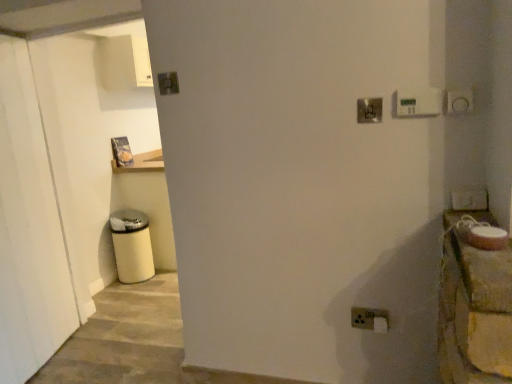
What is the approximate width of rustic wood countertop at right?

It is 4.46 inches.

Identify the location of white plastic light switch at upper right, which appears as the 1th light switch when viewed from the right. The image size is (512, 384). (469, 199).

What do you see at coordinates (370, 319) in the screenshot?
I see `white plastic electric outlet at lower right` at bounding box center [370, 319].

I want to click on white plastic thermostat at upper right, which is the first light switch from front to back, so click(418, 102).

The image size is (512, 384). I want to click on rustic wood countertop at right, so click(474, 307).

Is metallic square at upper center, the 1th light switch when ordered from left to right, situated inside rustic wood countertop at right or outside?

metallic square at upper center, the 1th light switch when ordered from left to right, exists outside the volume of rustic wood countertop at right.

Does point (167, 84) come behind point (464, 278)?

Yes.

Which of these two, metallic square at upper center, the 1th light switch when ordered from left to right, or rustic wood countertop at right, is thinner?

With smaller width is metallic square at upper center, the 1th light switch when ordered from left to right.

Would you consider rustic wood countertop at right to be distant from white plastic thermostat at upper right, the 4th light switch in the back-to-front sequence?

They are positioned close to each other.

Considering the relative sizes of rustic wood countertop at right and white plastic thermostat at upper right, the 4th light switch in the back-to-front sequence, in the image provided, is rustic wood countertop at right wider than white plastic thermostat at upper right, the 4th light switch in the back-to-front sequence,?

Indeed, rustic wood countertop at right has a greater width compared to white plastic thermostat at upper right, the 4th light switch in the back-to-front sequence.

Is rustic wood countertop at right shorter than white plastic thermostat at upper right, which is the third light switch in bottom-to-top order?

In fact, rustic wood countertop at right may be taller than white plastic thermostat at upper right, which is the third light switch in bottom-to-top order.

From a real-world perspective, which object stands above the other?

white plastic thermostat at upper right, the 4th light switch in the back-to-front sequence, from a real-world perspective.

Which is nearer, [432,114] or [464,364]?

Clearly, point [432,114] is more distant from the camera than point [464,364].

From the image's perspective, between white plastic thermostat at upper right, which is the first light switch from front to back, and rustic wood countertop at right, who is located below?

rustic wood countertop at right is shown below in the image.

From the picture: Which is more to the right, white plastic thermostat at upper right, the 4th light switch in the back-to-front sequence, or rustic wood countertop at right?

rustic wood countertop at right is more to the right.

Is point (481, 303) positioned in front of point (365, 328)?

That is True.

Which is correct: rustic wood countertop at right is inside white plastic electric outlet at lower right, or outside of it?

rustic wood countertop at right is spatially situated outside white plastic electric outlet at lower right.

From the picture: Considering the positions of objects rustic wood countertop at right and white plastic electric outlet at lower right in the image provided, who is more to the right, rustic wood countertop at right or white plastic electric outlet at lower right?

From the viewer's perspective, rustic wood countertop at right appears more on the right side.

Is metallic silver switch at upper right, arranged as the third light switch when viewed from the front, spatially inside white plastic light switch at upper right, the 4th light switch viewed from the top, or outside of it?

metallic silver switch at upper right, arranged as the third light switch when viewed from the front, is located beyond the bounds of white plastic light switch at upper right, the 4th light switch viewed from the top.

What's the angular difference between metallic silver switch at upper right, placed as the third light switch when sorted from right to left, and white plastic light switch at upper right, positioned as the 2th light switch in front-to-back order,'s facing directions?

0.475 degrees separate the facing orientations of metallic silver switch at upper right, placed as the third light switch when sorted from right to left, and white plastic light switch at upper right, positioned as the 2th light switch in front-to-back order.

Could you tell me if metallic silver switch at upper right, which ranks as the 3th light switch in top-to-bottom order, is turned towards white plastic light switch at upper right, which appears as the 1th light switch when viewed from the right?

No, metallic silver switch at upper right, which ranks as the 3th light switch in top-to-bottom order, does not turn towards white plastic light switch at upper right, which appears as the 1th light switch when viewed from the right.

Is metallic silver switch at upper right, which ranks as the 2th light switch in back-to-front order, wider or thinner than white plastic thermostat at upper right, marked as the 2th light switch in a right-to-left arrangement?

Clearly, metallic silver switch at upper right, which ranks as the 2th light switch in back-to-front order, has less width compared to white plastic thermostat at upper right, marked as the 2th light switch in a right-to-left arrangement.

Which is in front, point (369, 100) or point (424, 110)?

The point (424, 110) is more forward.

Considering the relative positions of metallic silver switch at upper right, marked as the second light switch in a bottom-to-top arrangement, and white plastic thermostat at upper right, which is the first light switch from front to back, in the image provided, is metallic silver switch at upper right, marked as the second light switch in a bottom-to-top arrangement, to the right of white plastic thermostat at upper right, which is the first light switch from front to back, from the viewer's perspective?

No, metallic silver switch at upper right, marked as the second light switch in a bottom-to-top arrangement, is not to the right of white plastic thermostat at upper right, which is the first light switch from front to back.

Are white plastic thermostat at upper right, which is counted as the 3th light switch, starting from the left, and metallic square at upper center, the fourth light switch in the front-to-back sequence, located far from each other?

No, white plastic thermostat at upper right, which is counted as the 3th light switch, starting from the left, is not far from metallic square at upper center, the fourth light switch in the front-to-back sequence.

Considering the relative sizes of white plastic thermostat at upper right, the 4th light switch in the back-to-front sequence, and metallic square at upper center, the 1th light switch when ordered from left to right, in the image provided, is white plastic thermostat at upper right, the 4th light switch in the back-to-front sequence, shorter than metallic square at upper center, the 1th light switch when ordered from left to right,?

Incorrect, the height of white plastic thermostat at upper right, the 4th light switch in the back-to-front sequence, does not fall short of that of metallic square at upper center, the 1th light switch when ordered from left to right.

Identify the location of light switch that appears above the white plastic thermostat at upper right, which is counted as the 3th light switch, starting from the left (from a real-world perspective). This screenshot has width=512, height=384. (168, 83).

This screenshot has height=384, width=512. In order to click on counter top in front of the metallic square at upper center, the fourth light switch in the front-to-back sequence in this screenshot , I will do `click(474, 307)`.

The height and width of the screenshot is (384, 512). Find the location of `the 1st light switch behind the rustic wood countertop at right, starting your count from the anchor`. the 1st light switch behind the rustic wood countertop at right, starting your count from the anchor is located at coordinates click(x=418, y=102).

Based on their spatial positions, is white plastic light switch at upper right, marked as the third light switch in a back-to-front arrangement, or white plastic electric outlet at lower right closer to metallic silver switch at upper right, which ranks as the 2th light switch in back-to-front order?

white plastic light switch at upper right, marked as the third light switch in a back-to-front arrangement, is positioned closer to the anchor metallic silver switch at upper right, which ranks as the 2th light switch in back-to-front order.

Considering their positions, is metallic silver switch at upper right, which ranks as the 3th light switch in top-to-bottom order, positioned further to white plastic thermostat at upper right, marked as the 2th light switch in a right-to-left arrangement, than rustic wood countertop at right?

rustic wood countertop at right.

Considering their positions, is white plastic thermostat at upper right, which is counted as the 3th light switch, starting from the left, positioned further to rustic wood countertop at right than metallic square at upper center, the fourth light switch in the front-to-back sequence?

metallic square at upper center, the fourth light switch in the front-to-back sequence, lies further to rustic wood countertop at right than the other object.

Considering their positions, is metallic silver switch at upper right, arranged as the third light switch when viewed from the front, positioned further to white plastic electric outlet at lower right than white plastic thermostat at upper right, marked as the 2th light switch in a right-to-left arrangement?

white plastic thermostat at upper right, marked as the 2th light switch in a right-to-left arrangement, is positioned further to the anchor white plastic electric outlet at lower right.

Estimate the real-world distances between objects in this image. Which object is closer to white plastic thermostat at upper right, the 4th light switch in the back-to-front sequence, metallic square at upper center, which ranks as the fourth light switch in bottom-to-top order, or metallic silver switch at upper right, marked as the second light switch in a bottom-to-top arrangement?

The object closer to white plastic thermostat at upper right, the 4th light switch in the back-to-front sequence, is metallic silver switch at upper right, marked as the second light switch in a bottom-to-top arrangement.

Looking at the image, which one is located further to white plastic light switch at upper right, which appears as the 1th light switch when viewed from the right, metallic silver switch at upper right, which ranks as the 3th light switch in top-to-bottom order, or rustic wood countertop at right?

The object further to white plastic light switch at upper right, which appears as the 1th light switch when viewed from the right, is metallic silver switch at upper right, which ranks as the 3th light switch in top-to-bottom order.

From the image, which object appears to be nearer to white plastic light switch at upper right, positioned as the 2th light switch in front-to-back order, white plastic electric outlet at lower right or metallic silver switch at upper right, marked as the second light switch in a bottom-to-top arrangement?

metallic silver switch at upper right, marked as the second light switch in a bottom-to-top arrangement, is closer to white plastic light switch at upper right, positioned as the 2th light switch in front-to-back order.

In the scene shown: When comparing their distances from white plastic light switch at upper right, marked as the third light switch in a back-to-front arrangement, does white plastic thermostat at upper right, the 4th light switch in the back-to-front sequence, or metallic square at upper center, the 1th light switch when ordered from left to right, seem closer?

The object closer to white plastic light switch at upper right, marked as the third light switch in a back-to-front arrangement, is white plastic thermostat at upper right, the 4th light switch in the back-to-front sequence.

At what (x,y) coordinates should I click in order to perform the action: click on counter top situated between metallic square at upper center, the fourth light switch in the right-to-left sequence, and white plastic light switch at upper right, the first light switch from the bottom, from left to right. Please return your answer as a coordinate pair (x, y). The image size is (512, 384). Looking at the image, I should click on (474, 307).

Locate an element on the screen. light switch between white plastic thermostat at upper right, which is the third light switch in bottom-to-top order, and white plastic light switch at upper right, marked as the third light switch in a back-to-front arrangement, vertically is located at coordinates [369, 110].

Image resolution: width=512 pixels, height=384 pixels. Identify the location of electric outlet between metallic silver switch at upper right, arranged as the third light switch when viewed from the front, and rustic wood countertop at right vertically. (370, 319).

I want to click on electric outlet situated between metallic square at upper center, which ranks as the fourth light switch in bottom-to-top order, and white plastic light switch at upper right, positioned as the 2th light switch in front-to-back order, from left to right, so click(x=370, y=319).